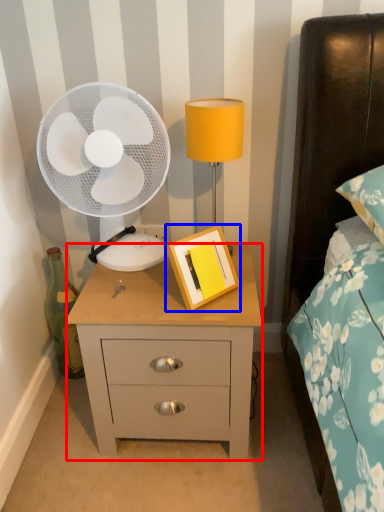
Question: Which object appears farthest to the camera in this image, nightstand (highlighted by a red box) or picture frame (highlighted by a blue box)?

Choices:
 (A) nightstand
 (B) picture frame

Answer: (A)